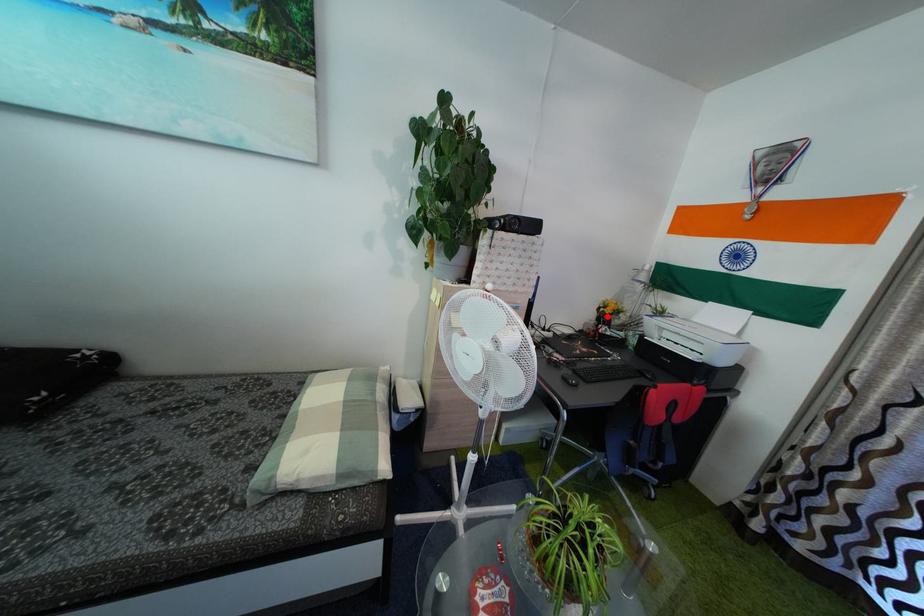
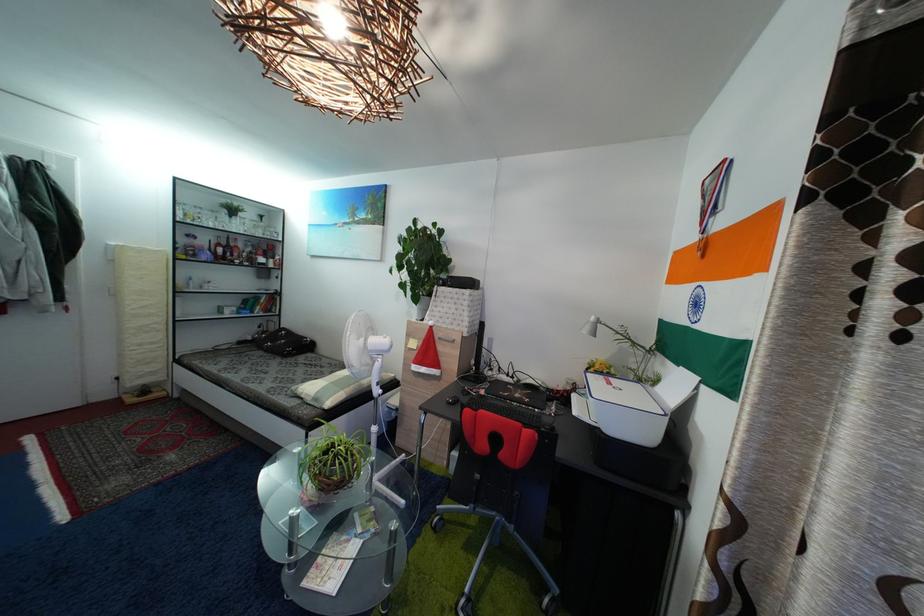
Find the pixel in the second image that matches the highlighted location in the first image.

(596, 377)